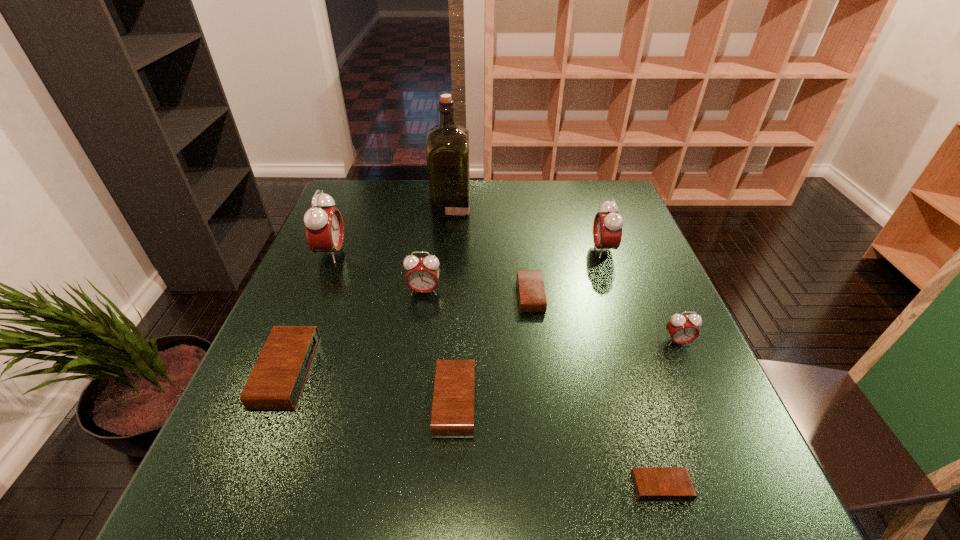
The height and width of the screenshot is (540, 960). Identify the location of vacant space located on the clock face of the seventh shortest object. (523, 249).

This screenshot has height=540, width=960. I want to click on vacant space located 0.270m on the clock face of the seventh shortest object, so click(494, 249).

Locate an element on the screen. The height and width of the screenshot is (540, 960). free space located 0.240m on the clock face of the seventh shortest object is located at coordinates (505, 249).

Locate an element on the screen. The width and height of the screenshot is (960, 540). vacant space positioned 0.370m on the clock face of the second smallest pink alarm clock is located at coordinates (403, 441).

Where is `vacant space located 0.300m on the clock face of the rightmost alarm clock`? This screenshot has width=960, height=540. vacant space located 0.300m on the clock face of the rightmost alarm clock is located at coordinates (743, 490).

The height and width of the screenshot is (540, 960). I want to click on free space located 0.300m on the front face of the leftmost black alarm clock, so click(458, 373).

I want to click on vacant space located on the front face of the fourth alarm clock from left to right, so click(538, 402).

This screenshot has width=960, height=540. I want to click on free space located on the front face of the second smallest black alarm clock, so click(465, 295).

What are the coordinates of `vacant space located on the front face of the second smallest black alarm clock` in the screenshot? It's located at (352, 295).

The image size is (960, 540). I want to click on free space located on the front face of the second smallest black alarm clock, so click(x=357, y=295).